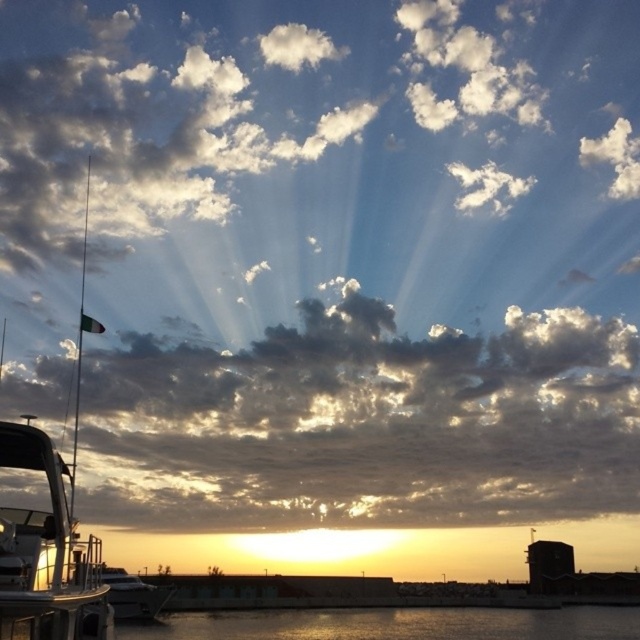
Question: Is cloudy sky at left behind white glossy boat at left?

Choices:
 (A) yes
 (B) no

Answer: (A)

Question: Can you confirm if shiny silver boat at left is positioned above shiny silver boat at lower left?

Choices:
 (A) no
 (B) yes

Answer: (B)

Question: Can you confirm if shiny silver boat at left is bigger than shiny silver boat at lower left?

Choices:
 (A) yes
 (B) no

Answer: (B)

Question: Which of these objects is positioned closest to the glistening silver water at lower center?

Choices:
 (A) shiny silver boat at lower left
 (B) shiny silver boat at left
 (C) cloudy sky at left
 (D) white glossy boat at left

Answer: (A)

Question: Which point is closer to the camera?

Choices:
 (A) cloudy sky at left
 (B) white glossy boat at left

Answer: (B)

Question: Which point is farther to the camera?

Choices:
 (A) shiny silver boat at lower left
 (B) shiny silver boat at left

Answer: (A)